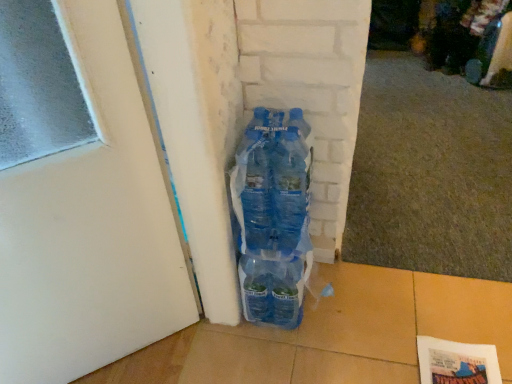
Question: Is there a large distance between white matte door at center and translucent plastic bottles at center?

Choices:
 (A) yes
 (B) no

Answer: (B)

Question: Is white matte door at center not within translucent plastic bottles at center?

Choices:
 (A) no
 (B) yes

Answer: (B)

Question: Is white matte door at center further to the viewer compared to translucent plastic bottles at center?

Choices:
 (A) yes
 (B) no

Answer: (B)

Question: Is the position of white matte door at center less distant than that of translucent plastic bottles at center?

Choices:
 (A) no
 (B) yes

Answer: (B)

Question: Could you tell me if white matte door at center is turned towards translucent plastic bottles at center?

Choices:
 (A) no
 (B) yes

Answer: (A)

Question: Is white matte door at center smaller than translucent plastic bottles at center?

Choices:
 (A) yes
 (B) no

Answer: (B)

Question: Is translucent plastic bottles at center thinner than white matte door at center?

Choices:
 (A) no
 (B) yes

Answer: (A)

Question: Is translucent plastic bottles at center oriented towards white matte door at center?

Choices:
 (A) no
 (B) yes

Answer: (A)

Question: Can you confirm if translucent plastic bottles at center is taller than white matte door at center?

Choices:
 (A) yes
 (B) no

Answer: (B)

Question: Does translucent plastic bottles at center have a greater width compared to white matte door at center?

Choices:
 (A) yes
 (B) no

Answer: (A)

Question: Would you say translucent plastic bottles at center is a long distance from white matte door at center?

Choices:
 (A) no
 (B) yes

Answer: (A)

Question: Is translucent plastic bottles at center at the right side of white matte door at center?

Choices:
 (A) yes
 (B) no

Answer: (A)

Question: Looking at the image, does white matte door at center seem bigger or smaller compared to translucent plastic bottles at center?

Choices:
 (A) big
 (B) small

Answer: (A)